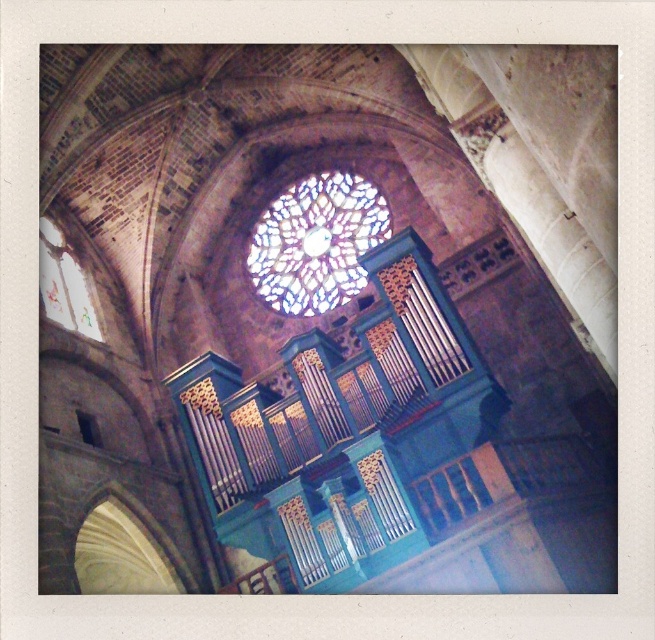
Between stained glass window at center and translucent stained glass at upper left, which one appears on the right side from the viewer's perspective?

stained glass window at center is more to the right.

Which is above, stained glass window at center or translucent stained glass at upper left?

stained glass window at center is above.

Does point (290, 268) come behind point (41, 289)?

That is True.

Locate an element on the screen. This screenshot has width=655, height=640. stained glass window at center is located at coordinates (316, 243).